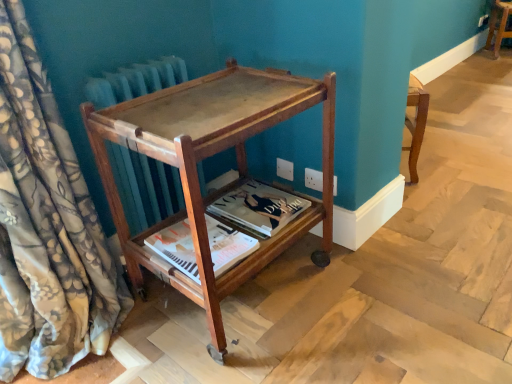
Question: Is matte paper magazine at center, which is counted as the 1th magazine, starting from the front, to the left or to the right of mahogany wood side table at center, the 2th furniture in the right-to-left sequence, in the image?

Choices:
 (A) left
 (B) right

Answer: (A)

Question: From their relative heights in the image, would you say matte paper magazine at center, which is counted as the 1th magazine, starting from the front, is taller or shorter than mahogany wood side table at center, arranged as the 2th furniture when viewed from the top?

Choices:
 (A) tall
 (B) short

Answer: (B)

Question: Estimate the real-world distances between objects in this image. Which object is closer to the matte paper magazine at center, which is counted as the 1th magazine, starting from the front?

Choices:
 (A) wooden stool at center, the 2th furniture from the front
 (B) matte paper magazine at center, positioned as the 2th magazine in front-to-back order
 (C) mahogany wood side table at center, the 2th furniture in the right-to-left sequence
 (D) floral silk curtain at left

Answer: (B)

Question: Which of these objects is positioned closest to the matte paper magazine at center, positioned as the 2th magazine in front-to-back order?

Choices:
 (A) wooden stool at center, placed as the first furniture when sorted from top to bottom
 (B) matte paper magazine at center, which is counted as the 1th magazine, starting from the front
 (C) floral silk curtain at left
 (D) mahogany wood side table at center, the 1th furniture from the front

Answer: (B)